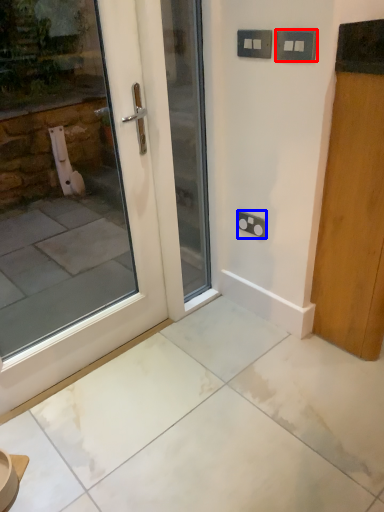
Question: Which object is further to the camera taking this photo, electric outlet (highlighted by a red box) or electric outlet (highlighted by a blue box)?

Choices:
 (A) electric outlet
 (B) electric outlet

Answer: (B)